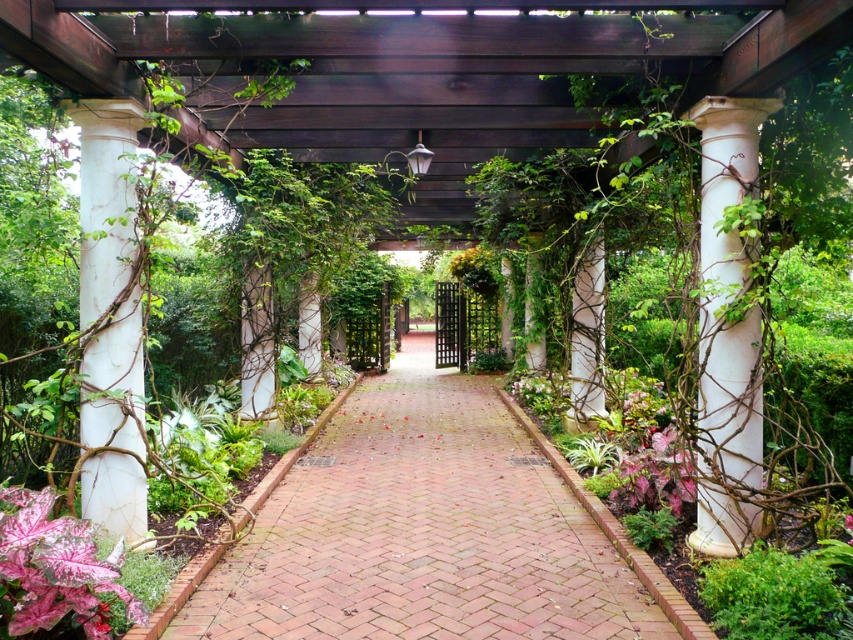
You are a gardener who needs to place a 10 feet long decorative bench along the garden pathway. The bench must be placed between the white marble column at center and the pink matte leaf at lower right. Is there enough space for the bench between these two objects?

The white marble column at center is 8.84 feet away from the pink matte leaf at lower right. Since the bench is 10 feet long, which is longer than the distance between them, there is not enough space to place the bench between these two objects.

You are a gardener with a 1.5 meter long hose. You need to water both the brick at center and the white marble column at left. Can you reach both objects with your hose without moving it?

The brick at center and the white marble column at left are 2.04 meters apart from each other. Since the hose is 1.5 meters long, you can reach both objects if they are within the hose length from the hose position. However, the distance between them is greater than the hose length, so you cannot reach both without moving the hose.